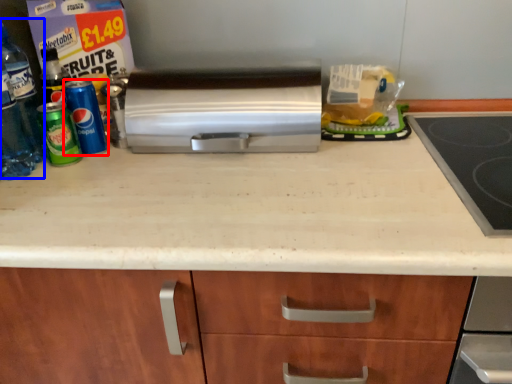
Question: Among these objects, which one is farthest to the camera, beverage (highlighted by a red box) or bottle (highlighted by a blue box)?

Choices:
 (A) beverage
 (B) bottle

Answer: (A)